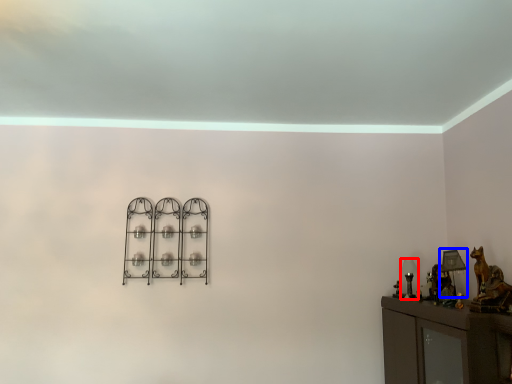
Question: Among these objects, which one is farthest to the camera, table lamp (highlighted by a red box) or table lamp (highlighted by a blue box)?

Choices:
 (A) table lamp
 (B) table lamp

Answer: (A)